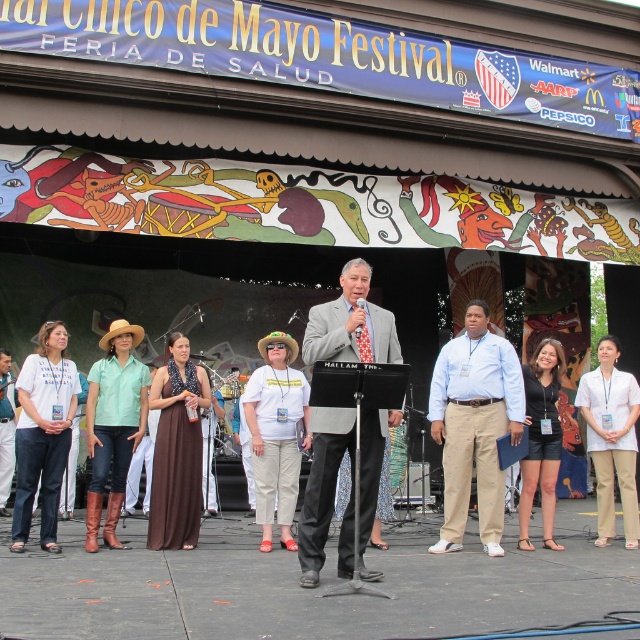
Question: Which of the following is the closest to the observer?

Choices:
 (A) white matte t-shirt at center
 (B) light blue shirt at center

Answer: (B)

Question: Where is light blue shirt at center located in relation to white matte t-shirt at center in the image?

Choices:
 (A) above
 (B) below

Answer: (A)

Question: Which of the following is the farthest from the observer?

Choices:
 (A) (500, 470)
 (B) (314, 547)
 (C) (609, 422)

Answer: (C)

Question: Is matte gray suit at center bigger than white smooth pants at center?

Choices:
 (A) no
 (B) yes

Answer: (A)

Question: Which point appears closest to the camera in this image?

Choices:
 (A) (481, 376)
 (B) (259, 339)
 (C) (310, 308)

Answer: (A)

Question: Can you confirm if matte gray suit at center is smaller than light blue shirt at center?

Choices:
 (A) yes
 (B) no

Answer: (A)